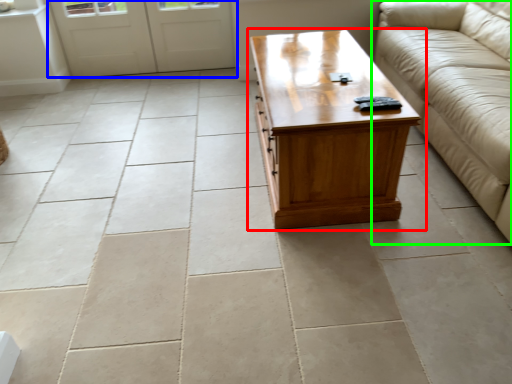
Question: Which object is the closest to the coffee table (highlighted by a red box)? Choose among these: door (highlighted by a blue box) or studio couch (highlighted by a green box).

Choices:
 (A) door
 (B) studio couch

Answer: (B)